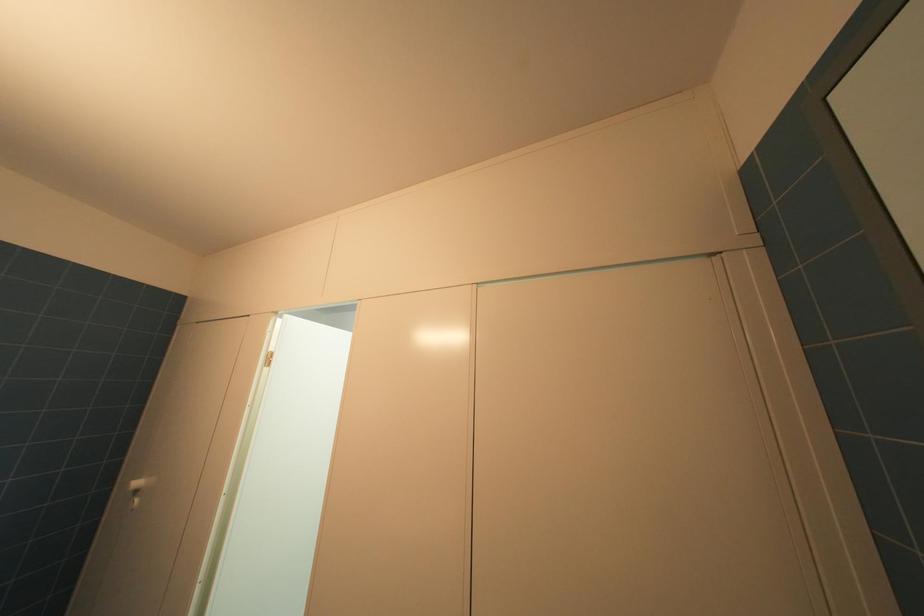
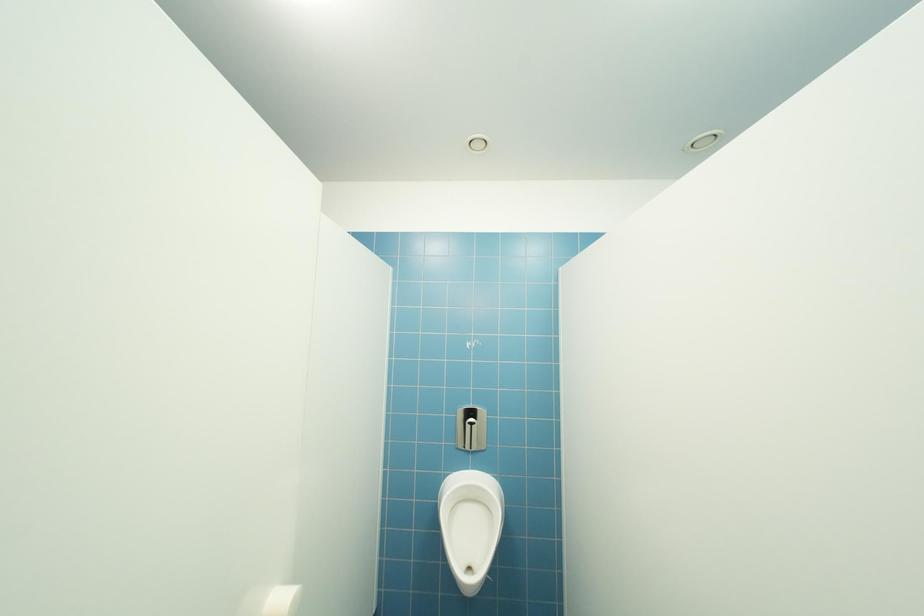
What movement of the cameraman would produce the second image?

The cameraman moved toward left, forward.